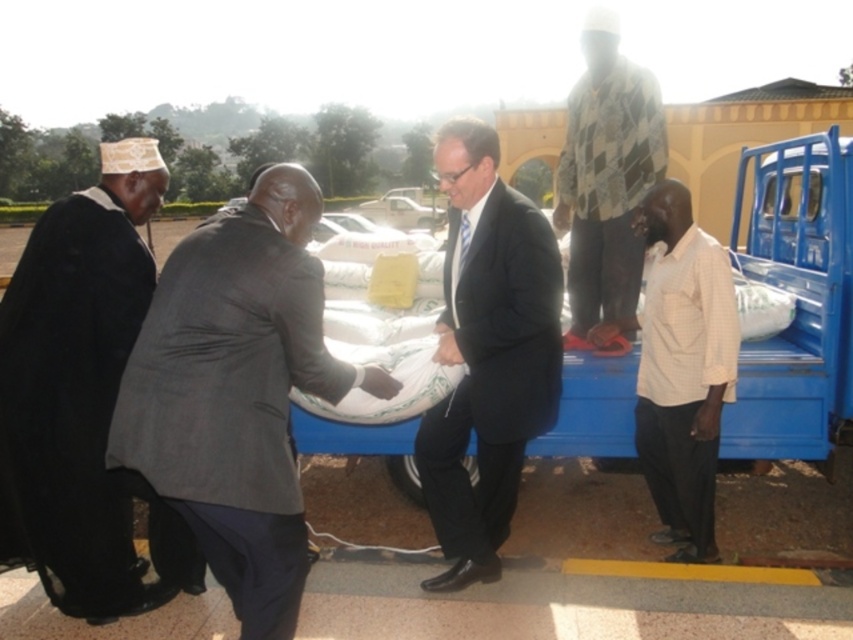
Does matte black suit at center appear over white checkered shirt at right?

Indeed, matte black suit at center is positioned over white checkered shirt at right.

Is point (453, 412) farther from camera compared to point (689, 417)?

No, it is not.

At what (x,y) coordinates should I click in order to perform the action: click on matte black suit at center. Please return your answer as a coordinate pair (x, y). Looking at the image, I should click on (486, 353).

Is point (88, 596) behind point (585, 40)?

No, it is in front of (585, 40).

Is black woolen robe at left to the right of checkered fabric shirt at upper center from the viewer's perspective?

No, black woolen robe at left is not to the right of checkered fabric shirt at upper center.

The width and height of the screenshot is (853, 640). Describe the element at coordinates (80, 385) in the screenshot. I see `black woolen robe at left` at that location.

At what (x,y) coordinates should I click in order to perform the action: click on black woolen robe at left. Please return your answer as a coordinate pair (x, y). The width and height of the screenshot is (853, 640). Looking at the image, I should click on (80, 385).

Who is shorter, gray wool suit at center or white checkered shirt at right?

With less height is gray wool suit at center.

Is point (183, 269) farther from viewer compared to point (660, 285)?

No, (183, 269) is in front of (660, 285).

The image size is (853, 640). What are the coordinates of `gray wool suit at center` in the screenshot? It's located at (235, 394).